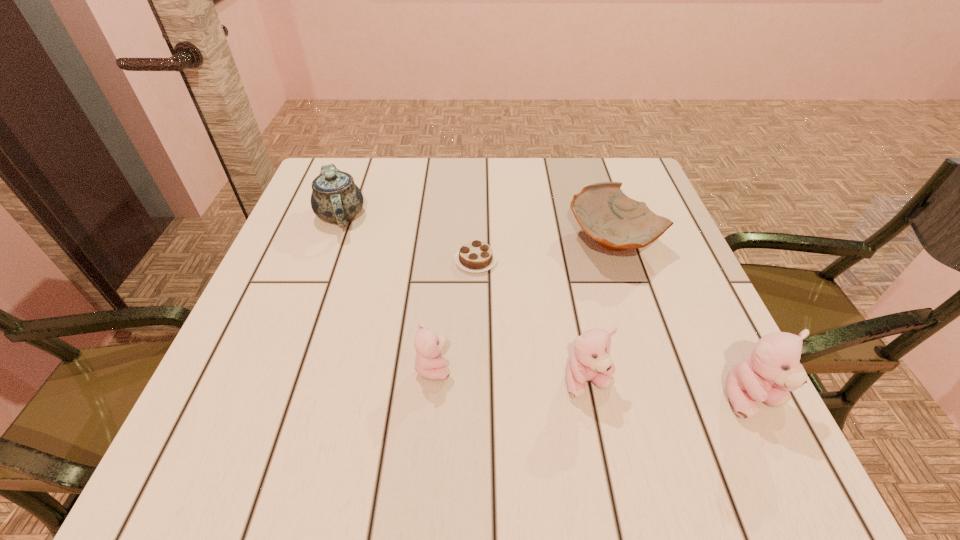
The height and width of the screenshot is (540, 960). Find the location of `teddy bear that is the closest to the pottery`. teddy bear that is the closest to the pottery is located at coordinates (590, 361).

At what (x,y) coordinates should I click in order to perform the action: click on vacant point that satisfies the following two spatial constraints: 1. from the spout of the leftmost object; 2. on the left side of the pottery. Please return your answer as a coordinate pair (x, y). Looking at the image, I should click on (332, 241).